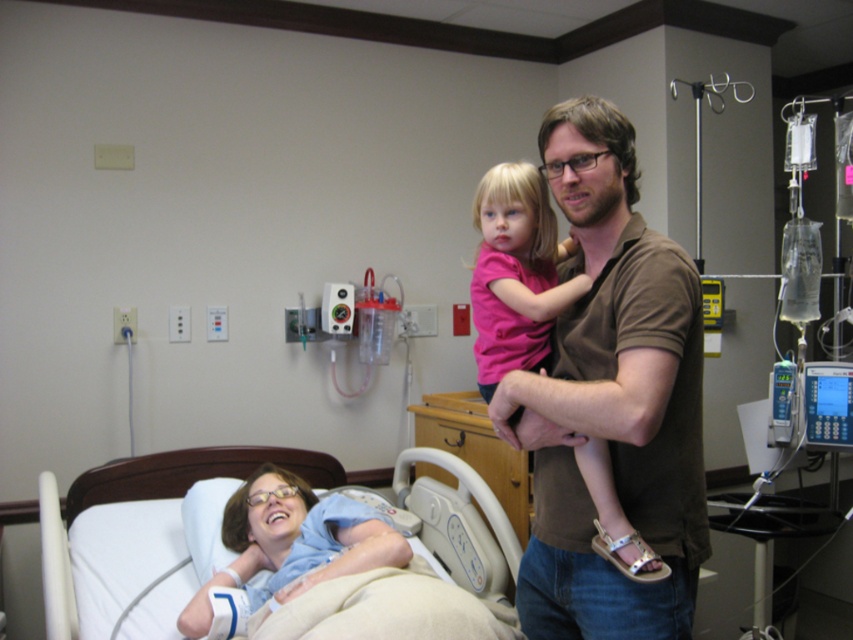
Question: Among these objects, which one is nearest to the camera?

Choices:
 (A) blue cotton shirt at lower left
 (B) brown cotton shirt at center

Answer: (B)

Question: Among these objects, which one is farthest from the camera?

Choices:
 (A) brown cotton shirt at center
 (B) white fabric bed at lower left
 (C) blue cotton shirt at lower left

Answer: (C)

Question: Can you confirm if white fabric bed at lower left is positioned to the left of blue cotton shirt at lower left?

Choices:
 (A) yes
 (B) no

Answer: (A)

Question: Can you confirm if brown cotton shirt at center is smaller than blue cotton shirt at lower left?

Choices:
 (A) yes
 (B) no

Answer: (B)

Question: Which point is farther to the camera?

Choices:
 (A) blue cotton shirt at lower left
 (B) white fabric bed at lower left
 (C) brown cotton shirt at center

Answer: (A)

Question: Does brown cotton shirt at center come in front of blue cotton shirt at lower left?

Choices:
 (A) no
 (B) yes

Answer: (B)